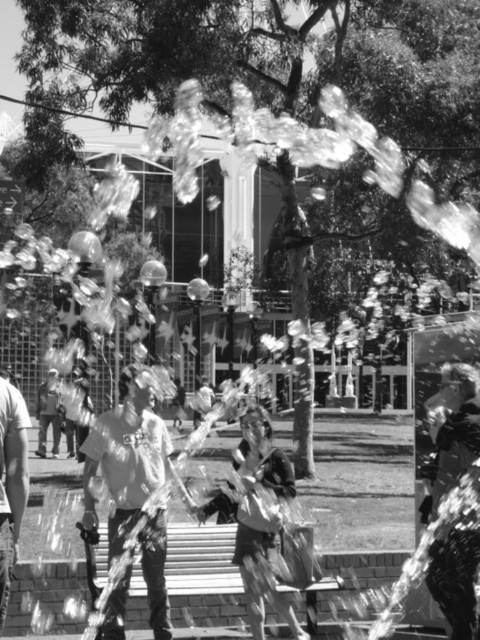
Question: Is matte white shirt at center to the left of matte white shirt at left from the viewer's perspective?

Choices:
 (A) no
 (B) yes

Answer: (A)

Question: Can you confirm if matte white shirt at center is thinner than matte white shirt at left?

Choices:
 (A) no
 (B) yes

Answer: (A)

Question: Which of the following is the closest to the observer?

Choices:
 (A) (115, 618)
 (B) (11, 387)

Answer: (B)

Question: Which object is farther from the camera taking this photo?

Choices:
 (A) matte white shirt at left
 (B) matte white shirt at center

Answer: (B)

Question: Is matte white shirt at center further to the viewer compared to matte white shirt at left?

Choices:
 (A) no
 (B) yes

Answer: (B)